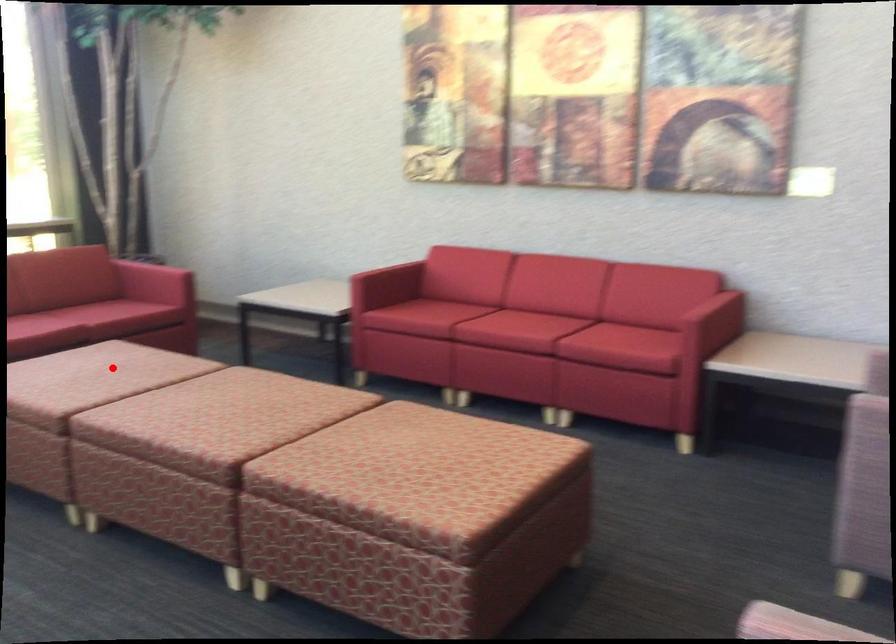
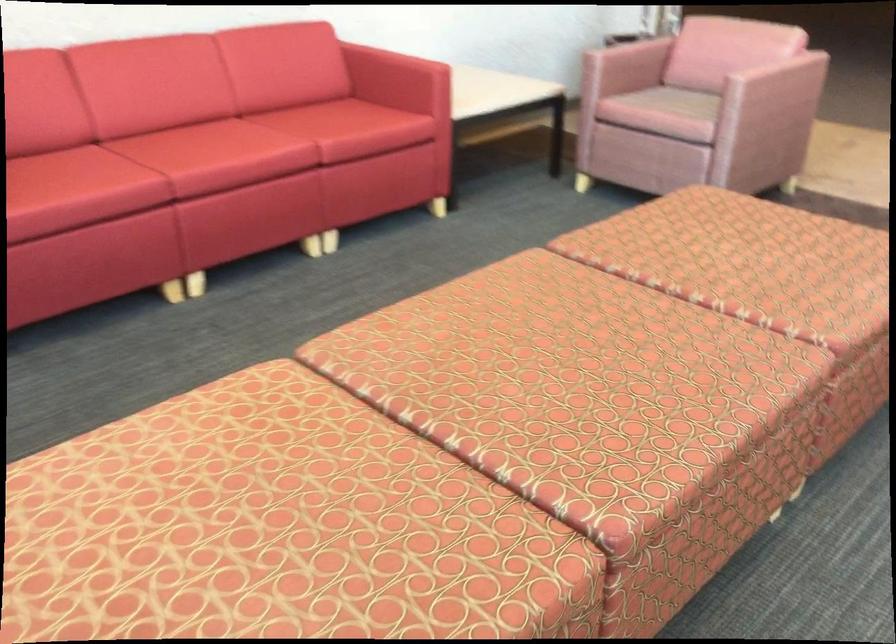
Locate, in the second image, the point that corresponds to the highlighted location in the first image.

(250, 522)